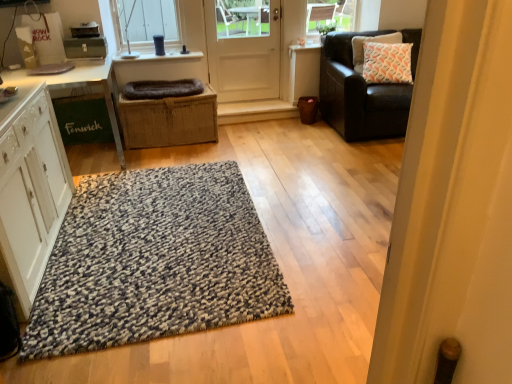
Question: Based on their positions, is white glossy table at left located to the left or right of dark gray plush dog bed at center?

Choices:
 (A) right
 (B) left

Answer: (B)

Question: Is white glossy table at left wider or thinner than dark gray plush dog bed at center?

Choices:
 (A) wide
 (B) thin

Answer: (A)

Question: Which of these objects is positioned farthest from the white matte door at center?

Choices:
 (A) braided wicker basket at center
 (B) white glossy table at left
 (C) white wood cabinet at left
 (D) white printed cushion at upper right
 (E) clear glass window at upper center

Answer: (C)

Question: Which object is positioned closest to the white glossy table at left?

Choices:
 (A) speckled wool rug at center
 (B) white matte door at center
 (C) braided wicker basket at center
 (D) clear glass window at upper center
 (E) white wood cabinet at left

Answer: (C)